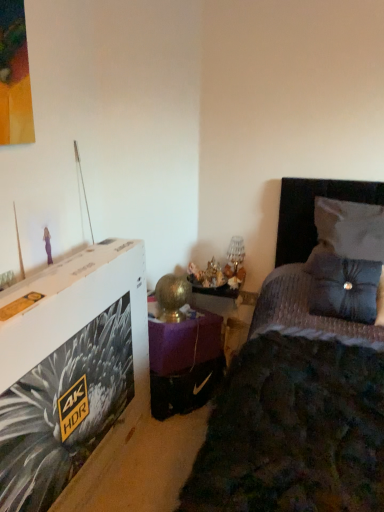
Question: Is white fabric pillow at upper right, arranged as the first pillow when viewed from the top, facing towards satin blue pillow at right, which ranks as the 2th pillow in top-to-bottom order?

Choices:
 (A) no
 (B) yes

Answer: (A)

Question: Would you say white fabric pillow at upper right, the second pillow in the bottom-to-top sequence, contains satin blue pillow at right, which ranks as the 2th pillow in top-to-bottom order?

Choices:
 (A) yes
 (B) no

Answer: (B)

Question: Is white fabric pillow at upper right, arranged as the first pillow when viewed from the top, bigger than satin blue pillow at right, arranged as the 1th pillow when ordered from the bottom?

Choices:
 (A) no
 (B) yes

Answer: (B)

Question: Considering the relative sizes of white fabric pillow at upper right, the second pillow in the bottom-to-top sequence, and satin blue pillow at right, which ranks as the 2th pillow in top-to-bottom order, in the image provided, is white fabric pillow at upper right, the second pillow in the bottom-to-top sequence, smaller than satin blue pillow at right, which ranks as the 2th pillow in top-to-bottom order,?

Choices:
 (A) no
 (B) yes

Answer: (A)

Question: From the image's perspective, would you say white fabric pillow at upper right, the second pillow in the bottom-to-top sequence, is positioned over satin blue pillow at right, arranged as the 1th pillow when ordered from the bottom?

Choices:
 (A) no
 (B) yes

Answer: (B)

Question: Do you think velvet dark blue bed at center is within purple velvet table at center, or outside of it?

Choices:
 (A) outside
 (B) inside

Answer: (A)

Question: In the image, is velvet dark blue bed at center on the left side or the right side of purple velvet table at center?

Choices:
 (A) right
 (B) left

Answer: (A)

Question: Is point (336, 480) closer or farther from the camera than point (150, 345)?

Choices:
 (A) closer
 (B) farther

Answer: (A)

Question: Looking at their shapes, would you say velvet dark blue bed at center is wider or thinner than purple velvet table at center?

Choices:
 (A) wide
 (B) thin

Answer: (A)

Question: Is point (339, 224) closer or farther from the camera than point (359, 297)?

Choices:
 (A) farther
 (B) closer

Answer: (A)

Question: From the image's perspective, is white fabric pillow at upper right, arranged as the first pillow when viewed from the top, positioned above or below satin blue pillow at right, which ranks as the 2th pillow in top-to-bottom order?

Choices:
 (A) below
 (B) above

Answer: (B)

Question: From a real-world perspective, is white fabric pillow at upper right, the second pillow in the bottom-to-top sequence, physically located above or below satin blue pillow at right, arranged as the 1th pillow when ordered from the bottom?

Choices:
 (A) below
 (B) above

Answer: (B)

Question: Based on their positions, is white fabric pillow at upper right, arranged as the first pillow when viewed from the top, located to the left or right of satin blue pillow at right, which ranks as the 2th pillow in top-to-bottom order?

Choices:
 (A) right
 (B) left

Answer: (A)

Question: Is point (365, 295) closer or farther from the camera than point (187, 403)?

Choices:
 (A) farther
 (B) closer

Answer: (B)

Question: Relative to purple velvet table at center, is satin blue pillow at right, which ranks as the 2th pillow in top-to-bottom order, in front or behind?

Choices:
 (A) behind
 (B) front

Answer: (B)